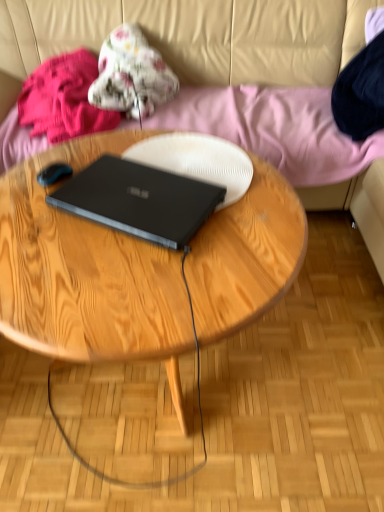
Question: Considering the positions of fluffy pink blanket at upper left, the 2th clothing viewed from the right, and wooden coffee table at center in the image, is fluffy pink blanket at upper left, the 2th clothing viewed from the right, bigger or smaller than wooden coffee table at center?

Choices:
 (A) big
 (B) small

Answer: (B)

Question: In terms of width, does fluffy pink blanket at upper left, the 2th clothing viewed from the right, look wider or thinner when compared to wooden coffee table at center?

Choices:
 (A) thin
 (B) wide

Answer: (A)

Question: Which is farther from the fluffy floral blanket at upper center, placed as the 2th clothing when sorted from left to right?

Choices:
 (A) beige leather couch at upper center
 (B) black matte laptop at center
 (C) fluffy pink blanket at upper left, the 2th clothing viewed from the right
 (D) wooden coffee table at center

Answer: (B)

Question: Which object is the closest to the black matte laptop at center?

Choices:
 (A) fluffy floral blanket at upper center, which is the 1th clothing from right to left
 (B) fluffy pink blanket at upper left, marked as the first clothing in a left-to-right arrangement
 (C) beige leather couch at upper center
 (D) wooden coffee table at center

Answer: (D)